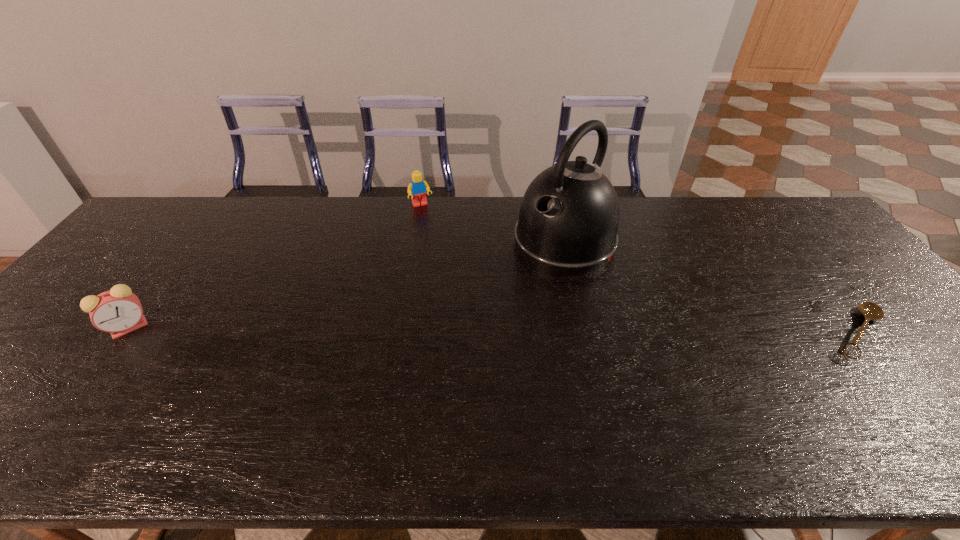
Identify the location of alarm clock. Image resolution: width=960 pixels, height=540 pixels. (118, 311).

I want to click on ladle, so click(x=871, y=311).

You are a GUI agent. You are given a task and a screenshot of the screen. Output one action in this format:
    pyautogui.click(x=<x>, y=<y>)
    Task: Click on the rightmost object
    This screenshot has width=960, height=540.
    Given the screenshot: What is the action you would take?
    pyautogui.click(x=871, y=311)

Find the location of `the tallest object`. the tallest object is located at coordinates (568, 221).

Locate an element on the screen. Image resolution: width=960 pixels, height=540 pixels. kettle is located at coordinates [x=568, y=221].

Identify the location of Lego. This screenshot has width=960, height=540. (417, 188).

Locate an element on the screen. Image resolution: width=960 pixels, height=540 pixels. the farthest object is located at coordinates (417, 188).

At what (x,y) coordinates should I click in order to perform the action: click on vacant position located on the face of the alarm clock. Please return your answer as a coordinate pair (x, y). The image size is (960, 540). Looking at the image, I should click on (75, 399).

This screenshot has width=960, height=540. Identify the location of free space located on the back of the ladle. (778, 233).

This screenshot has height=540, width=960. What are the coordinates of `vacant space located on the spout of the second object from right to left` in the screenshot? It's located at (511, 292).